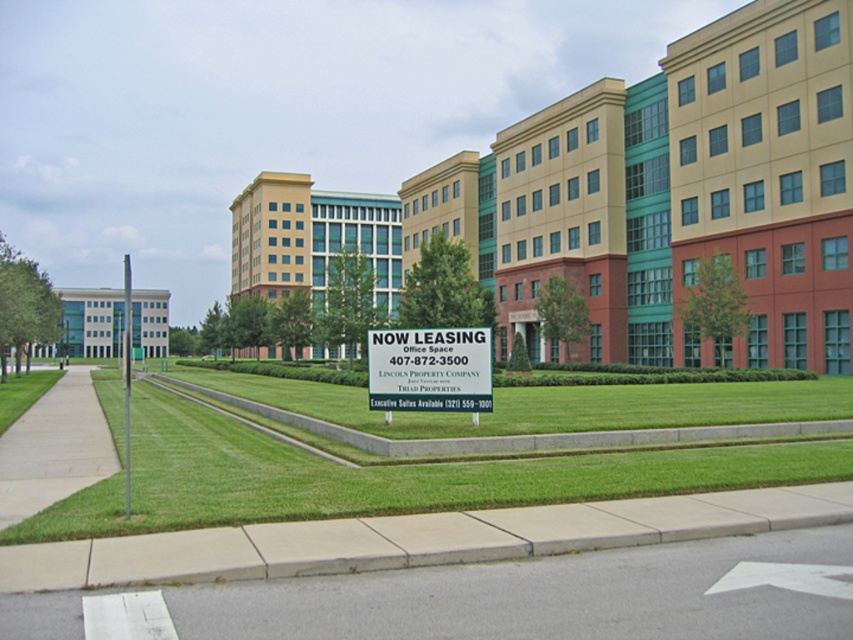
Which is above, gray asphalt at lower center or white plastic sign at center?

white plastic sign at center is higher up.

Can you confirm if gray asphalt at lower center is positioned to the right of white plastic sign at center?

Incorrect, gray asphalt at lower center is not on the right side of white plastic sign at center.

Image resolution: width=853 pixels, height=640 pixels. Describe the element at coordinates (538, 596) in the screenshot. I see `gray asphalt at lower center` at that location.

The image size is (853, 640). I want to click on gray asphalt at lower center, so click(x=538, y=596).